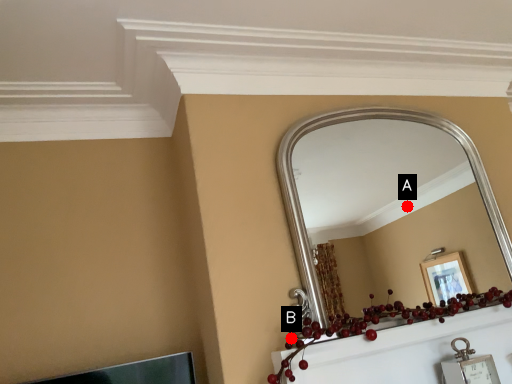
Question: Two points are circled on the image, labeled by A and B beside each circle. Which point appears closest to the camera in this image?

Choices:
 (A) A is closer
 (B) B is closer

Answer: (B)